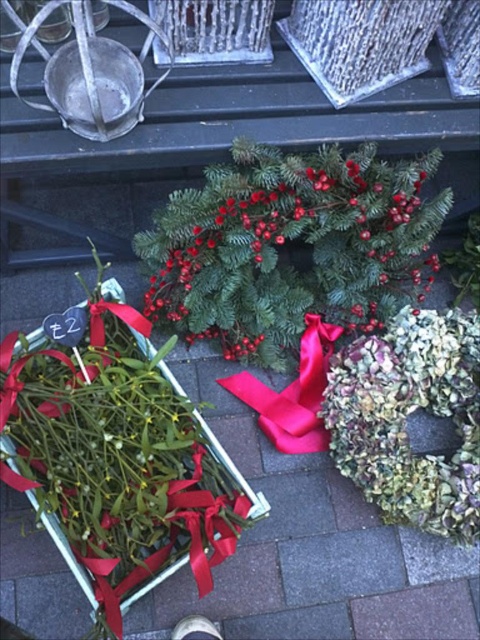
You are at a holiday market and see the green matte wreath at center and the shiny red ribbon at center. Which item would you need to wrap a gift if you want to use the larger object?

The green matte wreath at center is larger in size than the shiny red ribbon at center, so you should use the green matte wreath at center to wrap the gift.